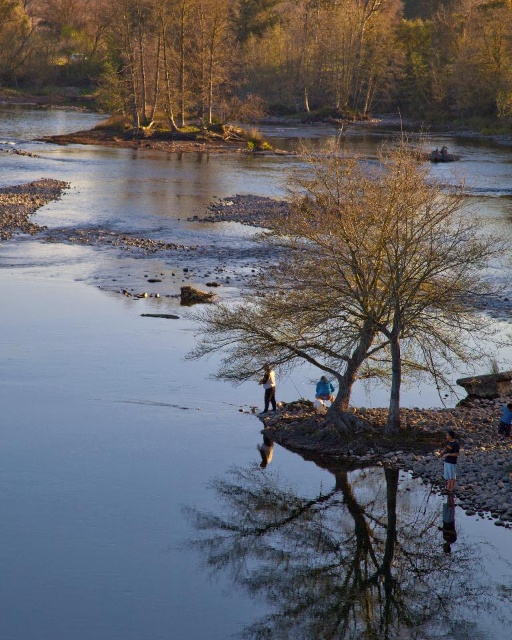
You are a photographer planning to capture a wide shot of the brown leafy tree at center and the blue denim jeans at lower center. Given that your camera can only focus on objects within a 3 meter width, will both objects fit within the frame?

The brown leafy tree at center is wider than the blue denim jeans at lower center. However, since the camera can focus on objects within a 3 meter width, both objects can fit within the frame as long as their combined widths do not exceed 3 meters. However, the exact dimensions are not provided, so it is uncertain. Please check the actual widths of both objects to confirm.